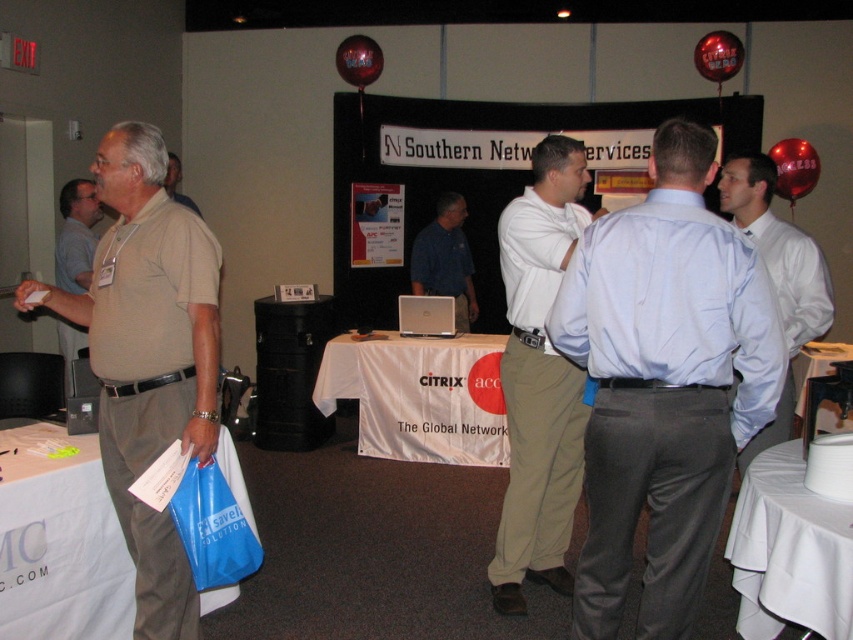
Based on the photo, you are at the networking event and want to move from the point at coordinates point [753,438] to the point at coordinates point [836,403]. Is the destination point closer to the camera or further away?

Point [753,438] is in front of point [836,403], so the destination point at [836,403] is further away from the camera compared to the starting point at [753,438].

You are a photographer at the event and need to capture both the light blue shirt at center and the white shirt at center in a single frame. Which shirt should you focus on to ensure both are clearly visible?

The light blue shirt at center is larger in size than the white shirt at center, so focusing on the light blue shirt at center will ensure both are clearly visible in the frame.